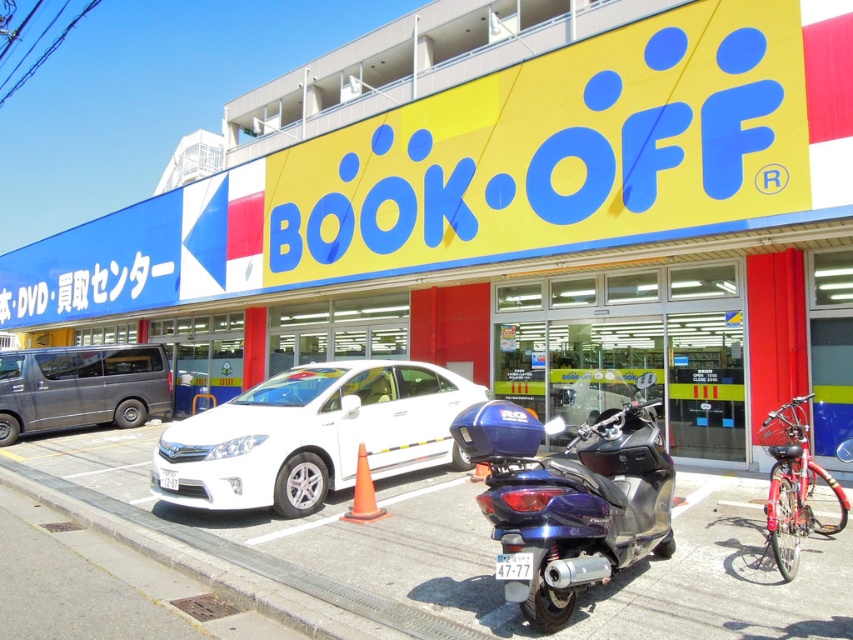
You are a customer arriving at the Book Off store and see a white glossy sedan at center and a metallic blue scooter at center. Which vehicle is positioned closer to the right side of the entrance?

The metallic blue scooter at center is closer to the right side of the entrance because the white glossy sedan at center is to the left of it.

You are a delivery driver who needs to park your truck next to the Book Off store. The parking spot available is only 5 meters long. The truck requires a minimum of 6 meters to park safely. You see the white glossy sedan at center and the silver metallic van at left. Which vehicle can you use as a reference to estimate if the parking spot is long enough for your truck?

The white glossy sedan at center is smaller than the silver metallic van at left. Since the parking spot is 5 meters long and the truck needs 6 meters, neither vehicle would be a good reference because even the larger silver metallic van at left is shorter than the required space. However, if you must choose, the silver metallic van at left is closer in size to the needed length but still insufficient.

You are a delivery driver who needs to park your 2.5 meter wide van. You see a silver metallic van at left and an orange matte cone at center. Which parking spot can accommodate your van based on their widths?

The silver metallic van at left has a larger width than the orange matte cone at center, so the parking spot where the silver metallic van at left is parked can accommodate your 2.5 meter wide van since it is wider than the cone, which might indicate the minimum width required.